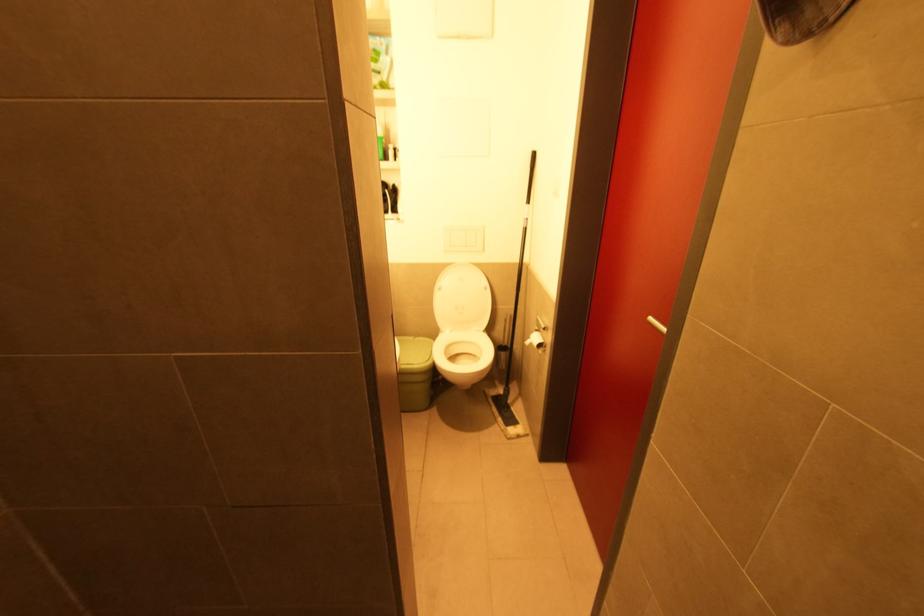
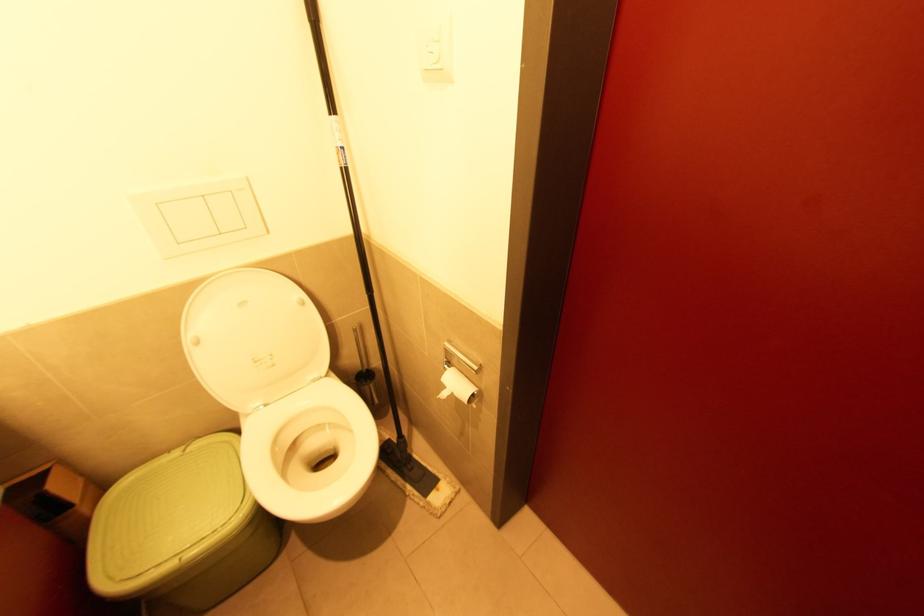
Locate, in the second image, the point that corresponds to (x=417, y=339) in the first image.

(187, 452)